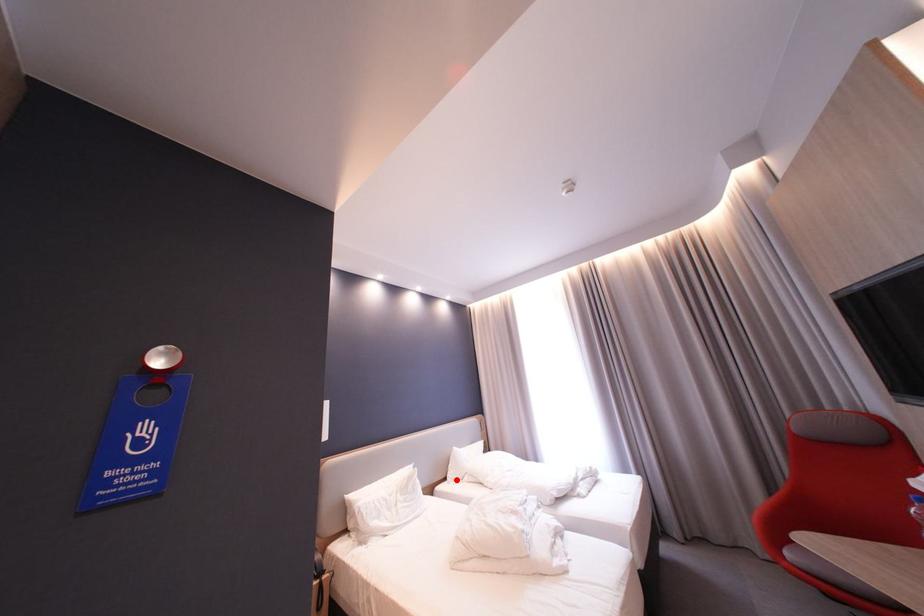
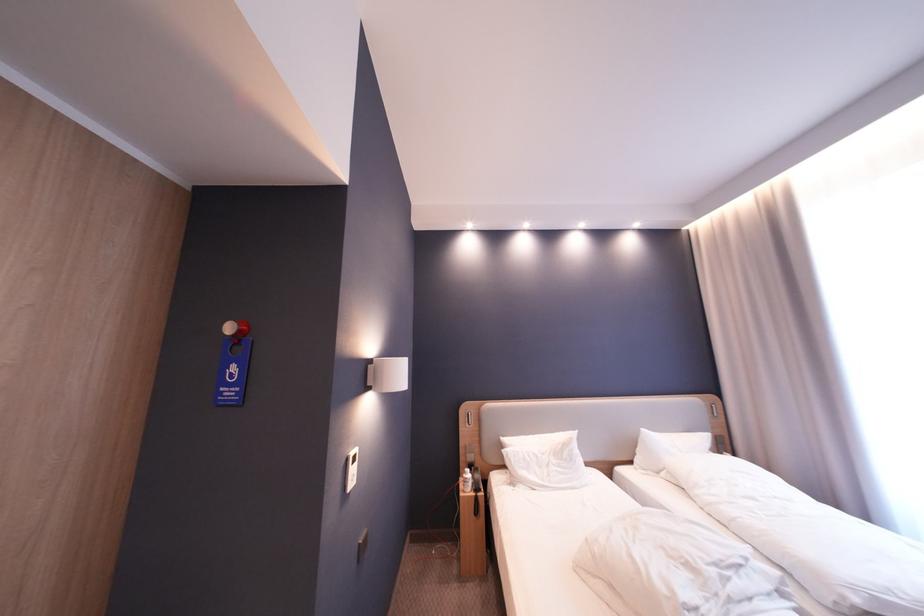
Where in the second image is the point corresponding to the highlighted location from the first image?

(641, 464)